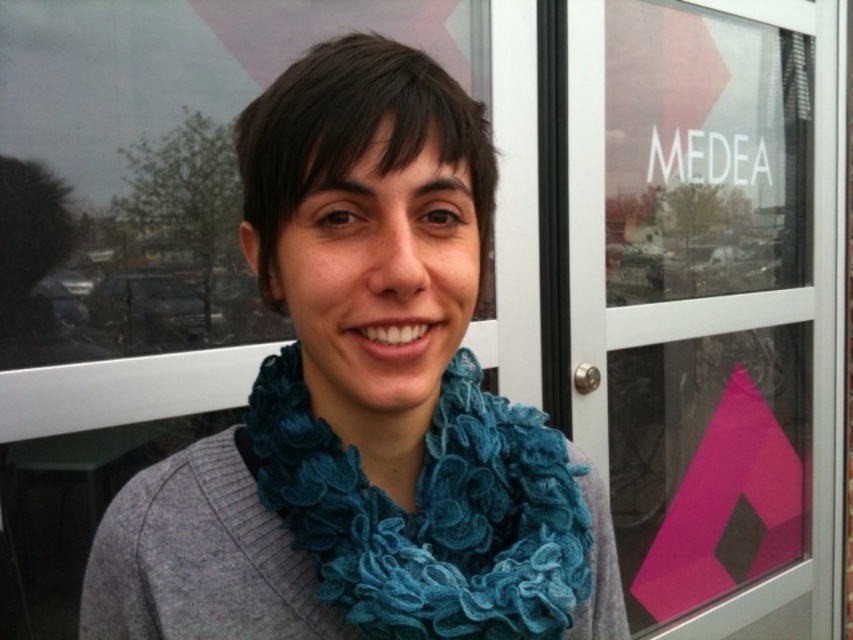
You are a fashion stylist trying to determine the layering of scarves for a client. Given the image, which scarf is visible on top when looking at the blue knitted scarf at center and the teal knitted scarf at center?

The blue knitted scarf at center is visible on top because it is in front of the teal knitted scarf at center.

You are trying to enter through the door shown in the image. The pink matte screen door at upper center is partially open. Can you fit through the opening if you are wearing the teal knitted scarf at center?

The pink matte screen door at upper center is larger than the teal knitted scarf at center, so yes, you can fit through the opening while wearing the teal knitted scarf at center.

You are a fashion designer observing the person in the image. You need to decide which scarf to recommend for a photoshoot that requires a more prominent accessory. Which one should you choose between the blue knitted scarf at center and the teal knitted scarf at center?

The blue knitted scarf at center has a larger size compared to the teal knitted scarf at center, so it would be more prominent and suitable for the photoshoot.